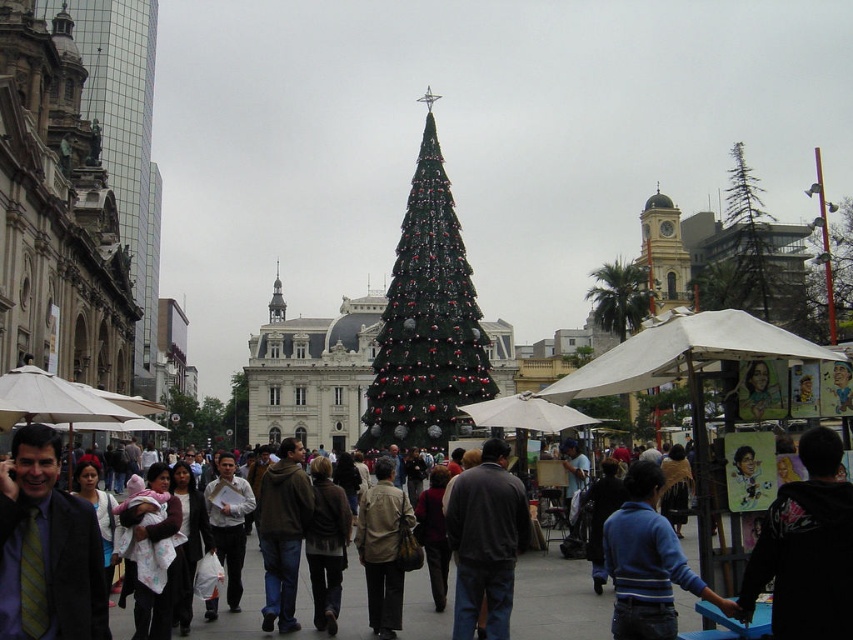
You are a photographer standing in the bustling urban scene. You want to take a photo of the green matte christmas tree at center and the blue striped sweater at lower right. Which object should you adjust your camera focus on first to ensure both are in focus?

The green matte christmas tree at center is further to the viewer than the blue striped sweater at lower right. To ensure both are in focus, you should adjust your camera focus on the green matte christmas tree at center first, as it is closer to you, and then the blue striped sweater at lower right will naturally fall into focus if the depth of field is sufficient.

You are standing in the middle of the scene and want to move towards the green matte christmas tree at center. Which direction should you walk relative to the dark gray jacket at center?

The green matte christmas tree at center is to the left of the dark gray jacket at center, so you should walk to the left relative to the dark gray jacket at center to reach it.